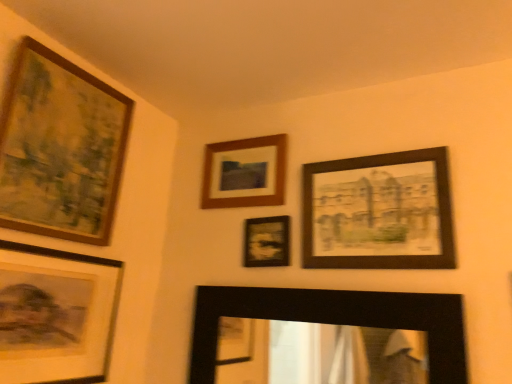
Question: From a real-world perspective, relative to matte black picture frame at center, positioned as the fourth picture frame in left-to-right order, is wooden frame at upper center, which is the 4th picture frame in right-to-left order, vertically above or below?

Choices:
 (A) above
 (B) below

Answer: (A)

Question: Relative to matte black picture frame at center, placed as the third picture frame when sorted from right to left, is wooden frame at upper center, which is the 4th picture frame in right-to-left order, in front or behind?

Choices:
 (A) front
 (B) behind

Answer: (B)

Question: Which object is the closest to the black matte mirror at lower center, which appears as the 5th picture frame when viewed from the left?

Choices:
 (A) wooden frame at upper center, which is the 4th picture frame in right-to-left order
 (B) wooden framed print at upper right, which appears as the sixth picture frame when viewed from the left
 (C) matte black picture frame at center, positioned as the fourth picture frame in left-to-right order
 (D) wooden-framed painting at upper left, the 6th picture frame from the right
 (E) matte black picture frame at lower left, placed as the second picture frame when sorted from left to right

Answer: (C)

Question: Estimate the real-world distances between objects in this image. Which object is farther from the black matte mirror at lower center, the 2th picture frame when ordered from right to left?

Choices:
 (A) matte black picture frame at center, placed as the third picture frame when sorted from right to left
 (B) wooden-framed painting at upper left, the 6th picture frame from the right
 (C) wooden frame at upper center, which is the 3th picture frame in left-to-right order
 (D) wooden framed print at upper right, arranged as the 1th picture frame when viewed from the right
 (E) matte black picture frame at lower left, placed as the second picture frame when sorted from left to right

Answer: (B)